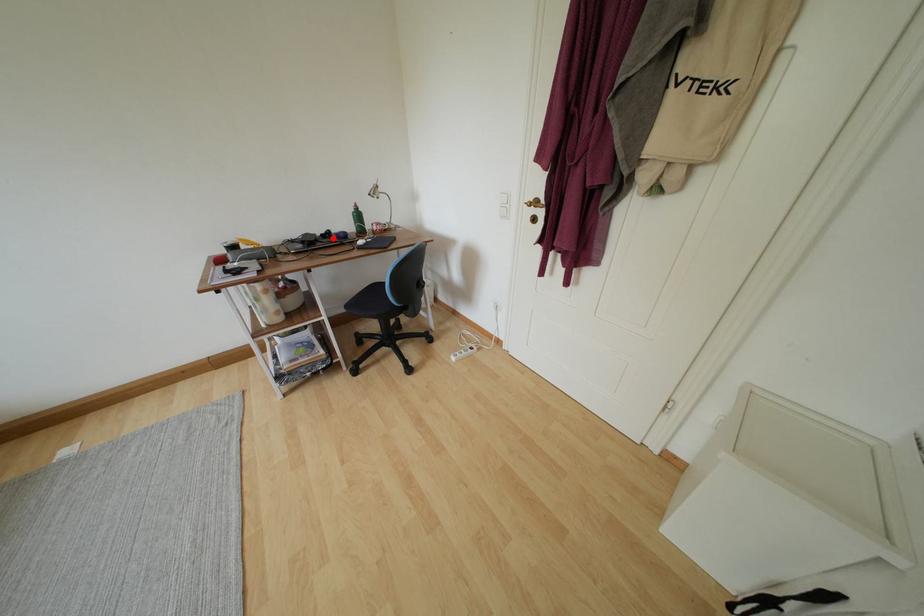
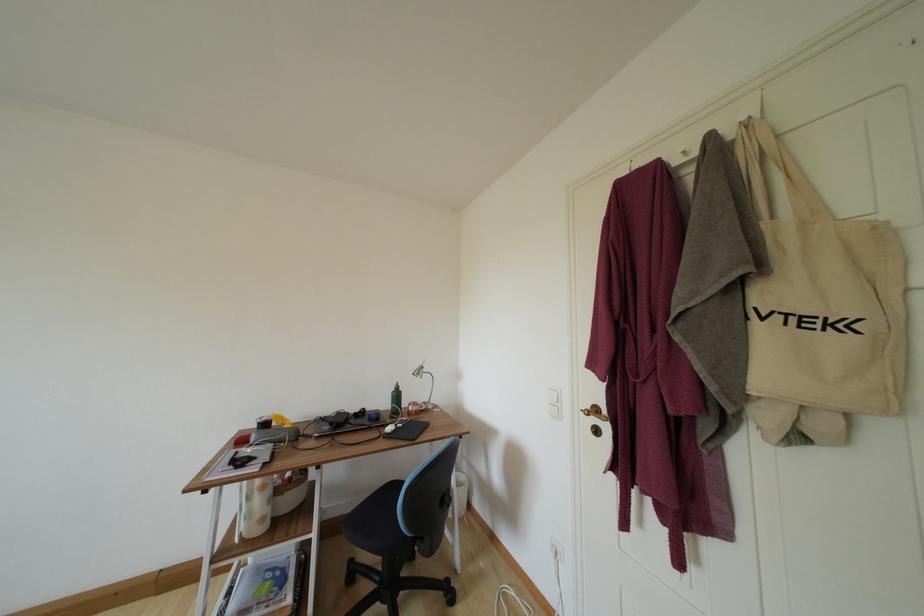
Question: I am providing you with two images of the same scene from different viewpoints. A red point is shown in image1. For the corresponding object point in image2, is it positioned nearer or farther from the camera?

Choices:
 (A) Nearer
 (B) Farther

Answer: (B)